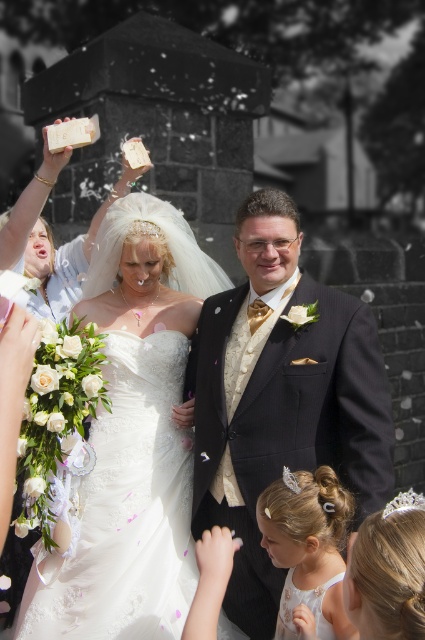
Is white lace dress at lower right smaller than matte white dress at upper left?

Actually, white lace dress at lower right might be larger than matte white dress at upper left.

Does white lace dress at lower right have a greater height compared to matte white dress at upper left?

Yes, white lace dress at lower right is taller than matte white dress at upper left.

At what (x,y) coordinates should I click in order to perform the action: click on white lace dress at lower right. Please return your answer as a coordinate pair (x, y). The height and width of the screenshot is (640, 425). Looking at the image, I should click on (308, 548).

Consider the image. Can you confirm if white satin dress at center is bigger than shiny black suit at center?

Yes.

Who is more distant from viewer, (146,525) or (223,490)?

The point (146,525) is behind.

What do you see at coordinates (133, 440) in the screenshot?
I see `white satin dress at center` at bounding box center [133, 440].

You are a GUI agent. You are given a task and a screenshot of the screen. Output one action in this format:
    pyautogui.click(x=<x>, y=<y>)
    Task: Click on the white satin dress at center
    
    Given the screenshot: What is the action you would take?
    pyautogui.click(x=133, y=440)

Which is below, white satin dress at center or matte white dress at upper left?

white satin dress at center is below.

Does point (184, 518) come farther from viewer compared to point (40, 244)?

No, (184, 518) is closer to viewer.

The image size is (425, 640). I want to click on white satin dress at center, so click(133, 440).